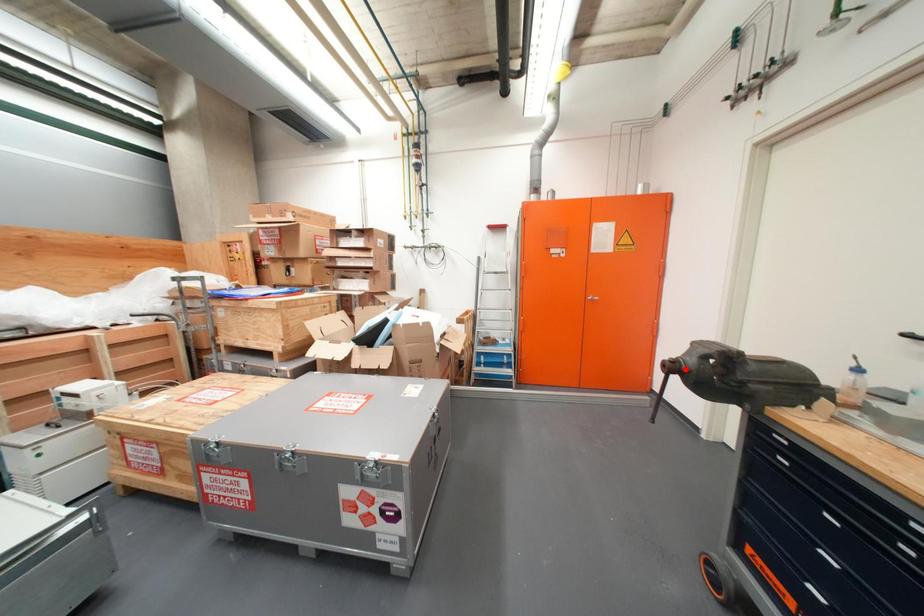
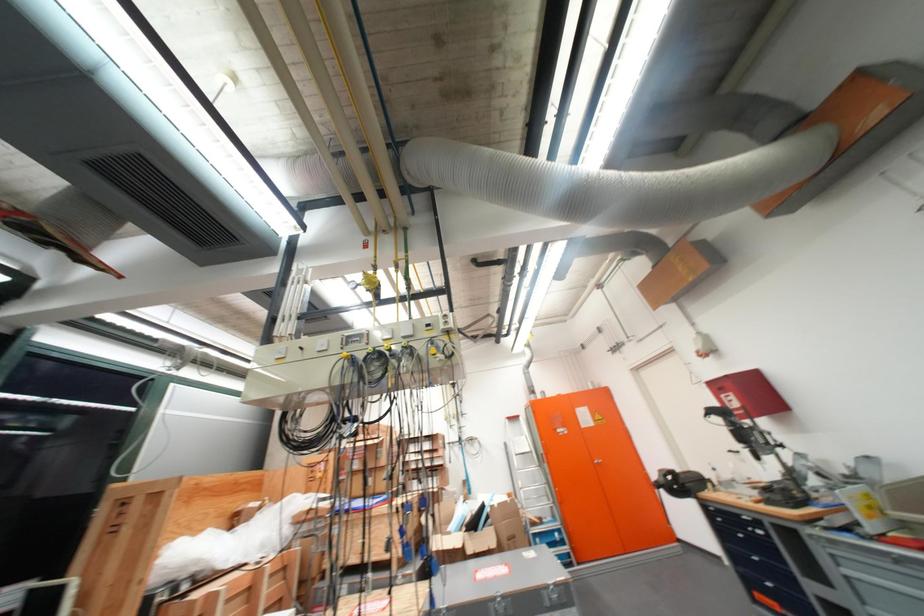
The point at the highlighted location is marked in the first image. Where is the corresponding point in the second image?

(670, 487)